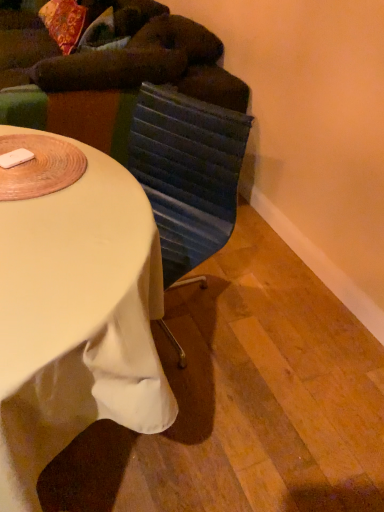
Image resolution: width=384 pixels, height=512 pixels. What do you see at coordinates (76, 316) in the screenshot? I see `white fabric-covered desk at center` at bounding box center [76, 316].

In order to face white fabric-covered desk at center, should I rotate leftwards or rightwards?

To align with it, rotate left about 17.720°.

This screenshot has height=512, width=384. I want to click on textured blue swivel chair at center, so click(187, 172).

Does white fabric-covered desk at center have a lesser width compared to textured blue swivel chair at center?

In fact, white fabric-covered desk at center might be wider than textured blue swivel chair at center.

Which is farther from the camera, (106, 391) or (216, 234)?

The point (216, 234) is farther from the camera.

Is white fabric-covered desk at center closer to camera compared to textured blue swivel chair at center?

Yes, white fabric-covered desk at center is closer to the viewer.

Between textured blue swivel chair at center and dark green fabric bean bag chair at upper left, which one appears on the right side from the viewer's perspective?

Positioned to the right is textured blue swivel chair at center.

From a real-world perspective, is textured blue swivel chair at center located higher than dark green fabric bean bag chair at upper left?

No.

Is textured blue swivel chair at center outside of dark green fabric bean bag chair at upper left?

That's correct, textured blue swivel chair at center is outside of dark green fabric bean bag chair at upper left.

Is the surface of textured blue swivel chair at center in direct contact with dark green fabric bean bag chair at upper left?

No, textured blue swivel chair at center is not with dark green fabric bean bag chair at upper left.

Identify the location of desk below the dark green fabric bean bag chair at upper left (from a real-world perspective). The width and height of the screenshot is (384, 512). (76, 316).

Considering the positions of point (107, 387) and point (25, 101), is point (107, 387) closer or farther from the camera than point (25, 101)?

Clearly, point (107, 387) is closer to the camera than point (25, 101).

How different are the orientations of white fabric-covered desk at center and dark green fabric bean bag chair at upper left in degrees?

white fabric-covered desk at center and dark green fabric bean bag chair at upper left are facing 1.71 degrees away from each other.

From the picture: Is white fabric-covered desk at center in front of dark green fabric bean bag chair at upper left?

Yes, white fabric-covered desk at center is closer to the camera.

Considering the sizes of objects dark green fabric bean bag chair at upper left and textured blue swivel chair at center in the image provided, who is shorter, dark green fabric bean bag chair at upper left or textured blue swivel chair at center?

With less height is textured blue swivel chair at center.

Is dark green fabric bean bag chair at upper left spatially inside textured blue swivel chair at center, or outside of it?

dark green fabric bean bag chair at upper left exists outside the volume of textured blue swivel chair at center.

From a real-world perspective, is dark green fabric bean bag chair at upper left over textured blue swivel chair at center?

Yes, from a real-world perspective, dark green fabric bean bag chair at upper left is above textured blue swivel chair at center.

Is dark green fabric bean bag chair at upper left positioned with its back to textured blue swivel chair at center?

That's not correct — dark green fabric bean bag chair at upper left is not looking away from textured blue swivel chair at center.

Visually, is textured blue swivel chair at center positioned to the left or to the right of white fabric-covered desk at center?

textured blue swivel chair at center is positioned on white fabric-covered desk at center's right side.

From the image's perspective, between textured blue swivel chair at center and white fabric-covered desk at center, which one is located above?

From the image's view, textured blue swivel chair at center is above.

Based on their sizes in the image, would you say textured blue swivel chair at center is bigger or smaller than white fabric-covered desk at center?

In the image, textured blue swivel chair at center appears to be smaller than white fabric-covered desk at center.

Is point (188, 257) closer or farther from the camera than point (162, 388)?

Point (188, 257) appears to be farther away from the viewer than point (162, 388).

Considering the relative sizes of dark green fabric bean bag chair at upper left and white fabric-covered desk at center in the image provided, is dark green fabric bean bag chair at upper left shorter than white fabric-covered desk at center?

No, dark green fabric bean bag chair at upper left is not shorter than white fabric-covered desk at center.

Locate an element on the screen. The width and height of the screenshot is (384, 512). desk below the dark green fabric bean bag chair at upper left (from a real-world perspective) is located at coordinates (76, 316).

Can you see dark green fabric bean bag chair at upper left touching white fabric-covered desk at center?

No, dark green fabric bean bag chair at upper left is not beside white fabric-covered desk at center.

Is point (159, 37) farther from viewer compared to point (127, 224)?

Yes, it is.

Where is `desk lying in front of the textured blue swivel chair at center`? desk lying in front of the textured blue swivel chair at center is located at coordinates (76, 316).

This screenshot has width=384, height=512. I want to click on bean bag chair above the textured blue swivel chair at center (from the image's perspective), so click(x=107, y=69).

From the image, which object appears to be farther from textured blue swivel chair at center, dark green fabric bean bag chair at upper left or white fabric-covered desk at center?

Based on the image, dark green fabric bean bag chair at upper left appears to be further to textured blue swivel chair at center.

Which object lies further to the anchor point dark green fabric bean bag chair at upper left, white fabric-covered desk at center or textured blue swivel chair at center?

white fabric-covered desk at center.

Considering their positions, is white fabric-covered desk at center positioned further to textured blue swivel chair at center than dark green fabric bean bag chair at upper left?

dark green fabric bean bag chair at upper left lies further to textured blue swivel chair at center than the other object.

Looking at the image, which one is located closer to white fabric-covered desk at center, dark green fabric bean bag chair at upper left or textured blue swivel chair at center?

textured blue swivel chair at center.

Looking at the image, which one is located further to white fabric-covered desk at center, textured blue swivel chair at center or dark green fabric bean bag chair at upper left?

dark green fabric bean bag chair at upper left is positioned further to the anchor white fabric-covered desk at center.

Based on the photo, looking at the image, which one is located closer to dark green fabric bean bag chair at upper left, textured blue swivel chair at center or white fabric-covered desk at center?

textured blue swivel chair at center is closer to dark green fabric bean bag chair at upper left.

Identify the location of swivel chair between dark green fabric bean bag chair at upper left and white fabric-covered desk at center vertically. (187, 172).